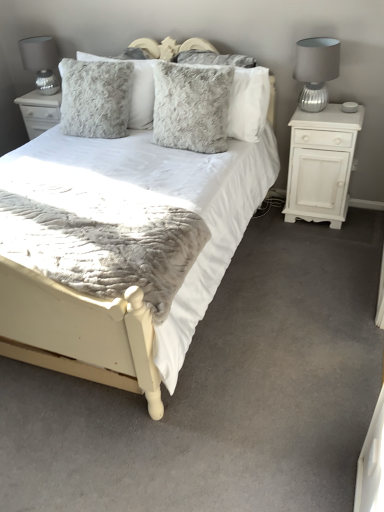
The width and height of the screenshot is (384, 512). I want to click on vacant area that is situated to the right of white matte cabinet at right, so click(x=360, y=220).